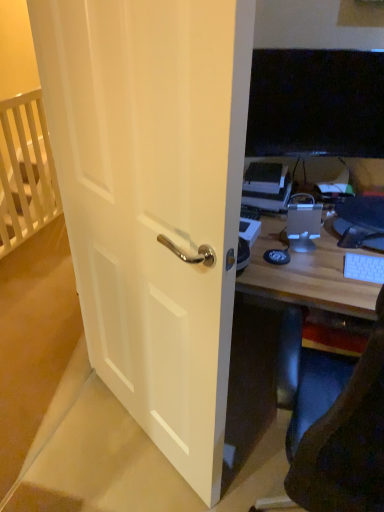
The width and height of the screenshot is (384, 512). Find the location of `free space to the left of white plastic keyboard at right`. free space to the left of white plastic keyboard at right is located at coordinates (324, 276).